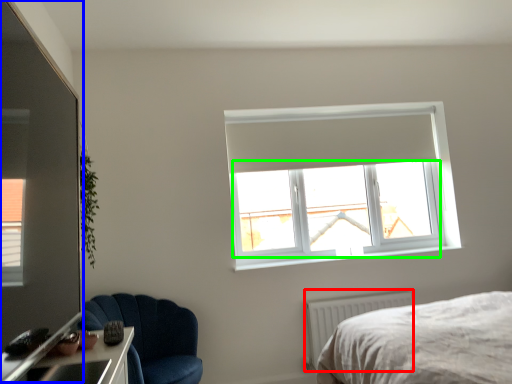
Question: Which object is positioned closest to radiator (highlighted by a red box)? Select from glass door (highlighted by a blue box) and window screen (highlighted by a green box).

Choices:
 (A) glass door
 (B) window screen

Answer: (B)